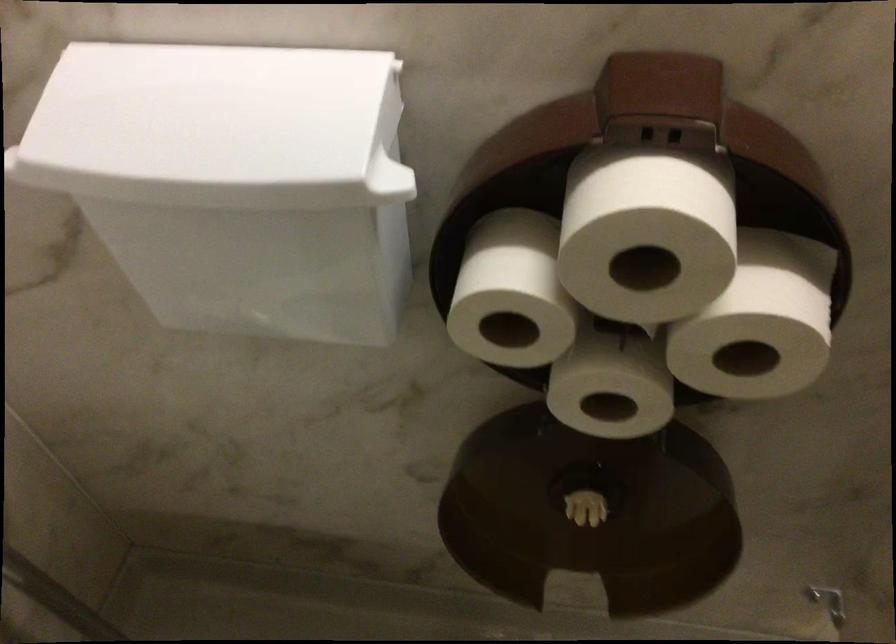
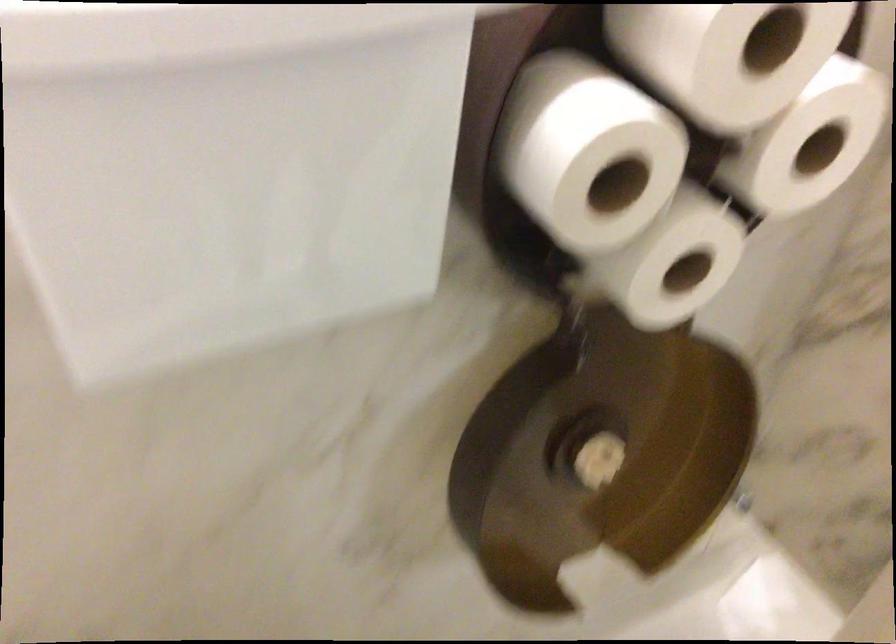
Question: The images are taken continuously from a first-person perspective. In which direction is your viewpoint rotating?

Choices:
 (A) Left
 (B) Right
 (C) Up
 (D) Down

Answer: (B)